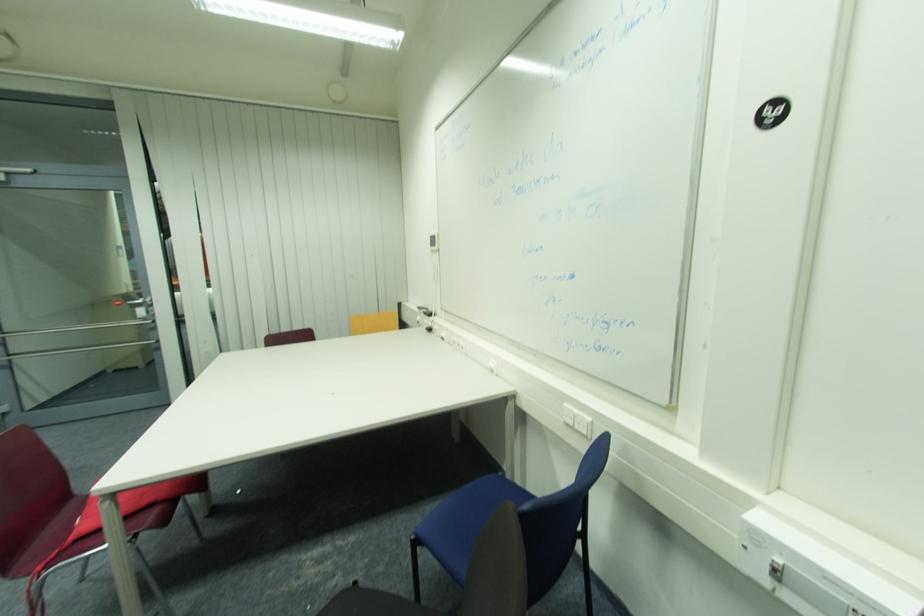
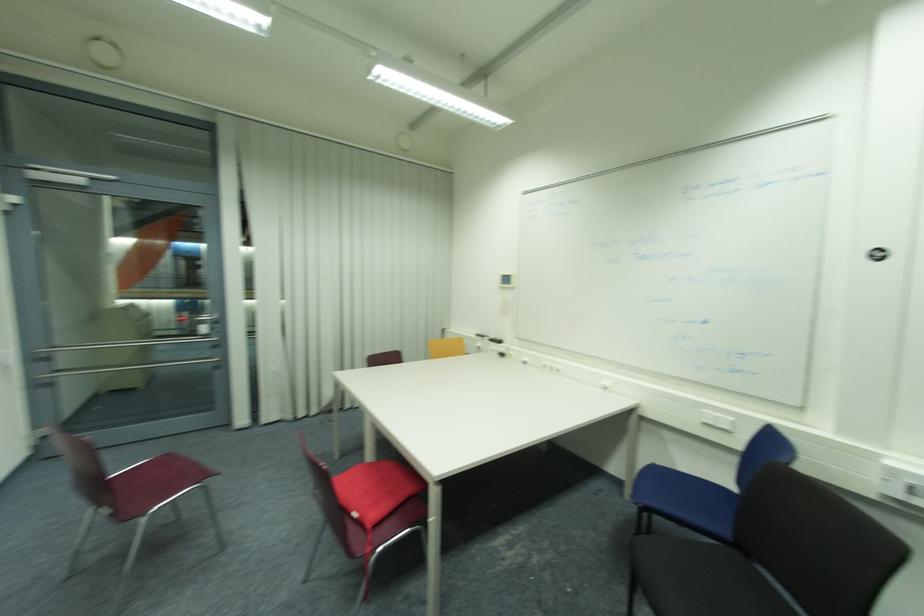
Find the pixel in the second image that matches the point at 151,314 in the first image.

(217, 330)